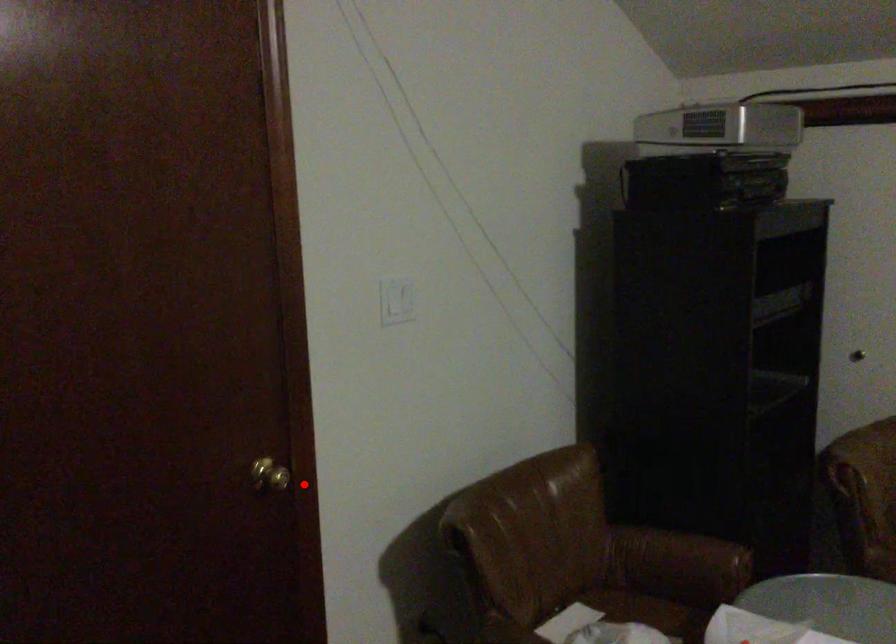
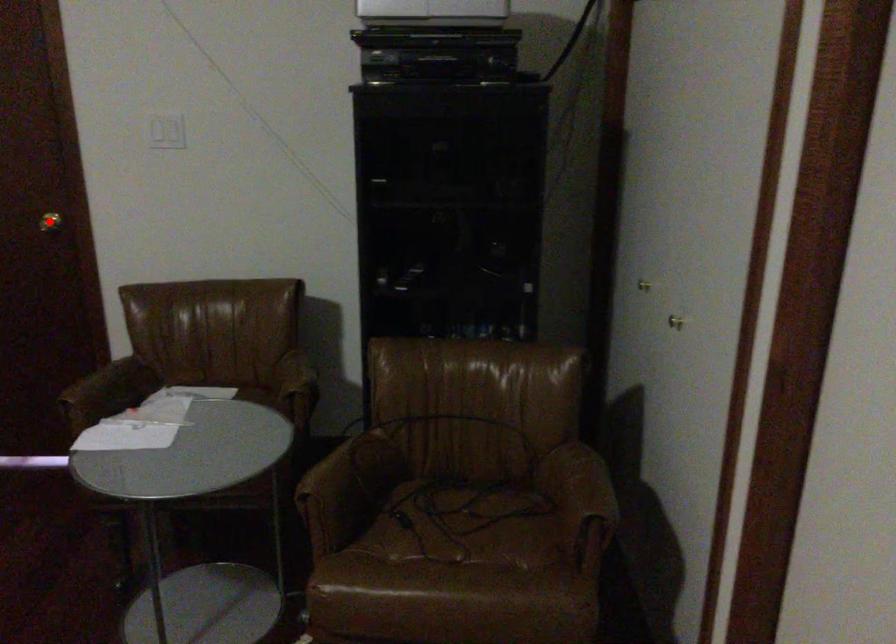
I am providing you with two images of the same scene from different viewpoints. A red point is marked on the first image and another point is marked on the second image. Is the marked point in image1 the same physical position as the marked point in image2?

Yes